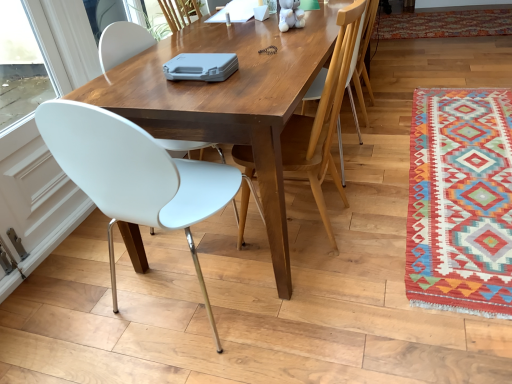
The height and width of the screenshot is (384, 512). Find the location of `blank space to the left of multicolored woven rug at lower right, which appears as the second mat when viewed from the back`. blank space to the left of multicolored woven rug at lower right, which appears as the second mat when viewed from the back is located at coordinates (300, 231).